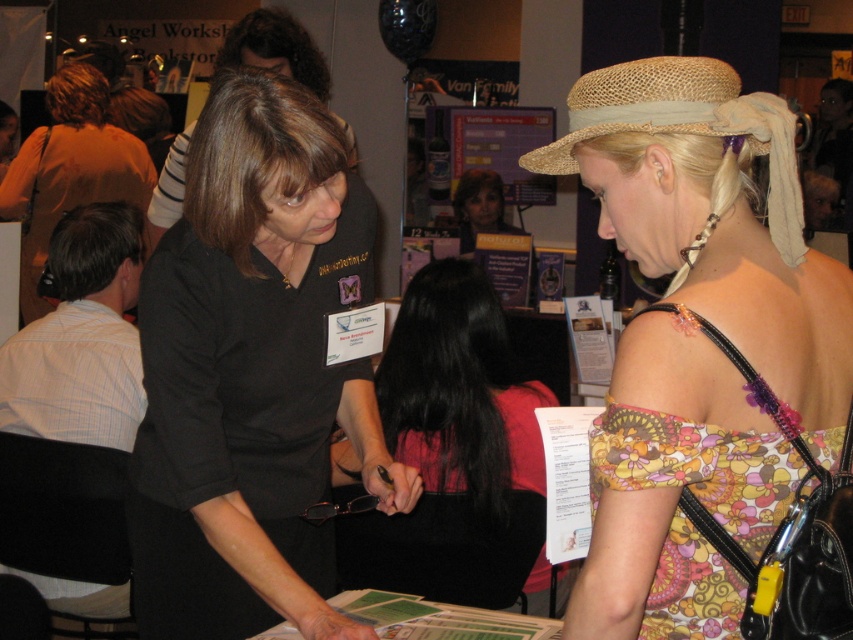
Question: Which point is closer to the camera?

Choices:
 (A) black matte shirt at center
 (B) dark red fabric shirt at center

Answer: (A)

Question: Which of the following is the farthest from the observer?

Choices:
 (A) 728,76
 (B) 685,97
 (C) 486,300

Answer: (C)

Question: Can you confirm if matte black shirt at left is thinner than natural straw hat at upper right?

Choices:
 (A) no
 (B) yes

Answer: (A)

Question: Which of the following is the closest to the observer?

Choices:
 (A) black matte shirt at center
 (B) matte black shirt at left
 (C) dark red fabric shirt at center

Answer: (A)

Question: Can you confirm if black matte shirt at center is positioned to the right of dark red fabric shirt at center?

Choices:
 (A) yes
 (B) no

Answer: (B)

Question: Is floral print dress at center positioned at the back of matte black shirt at left?

Choices:
 (A) no
 (B) yes

Answer: (A)